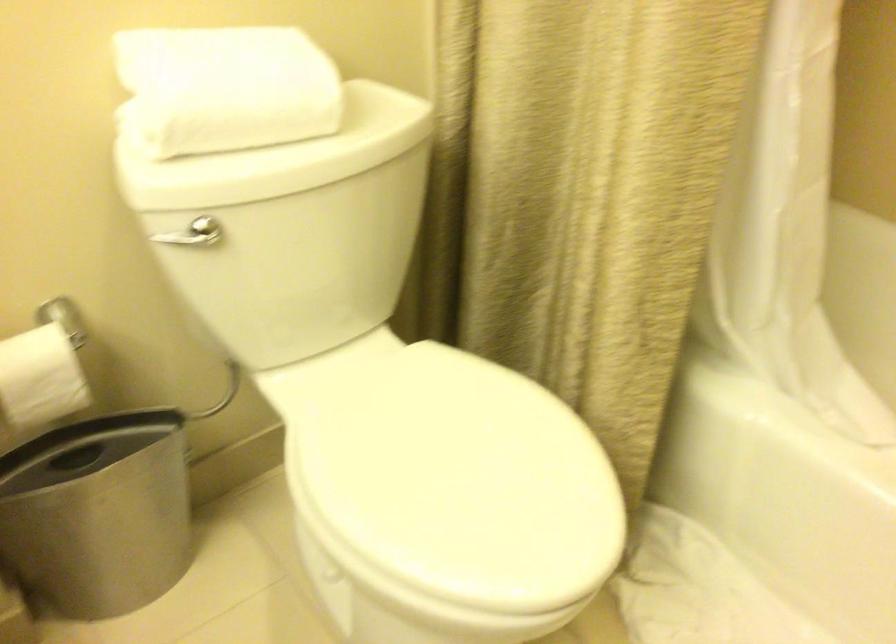
The height and width of the screenshot is (644, 896). I want to click on white toilet seat, so click(442, 485).